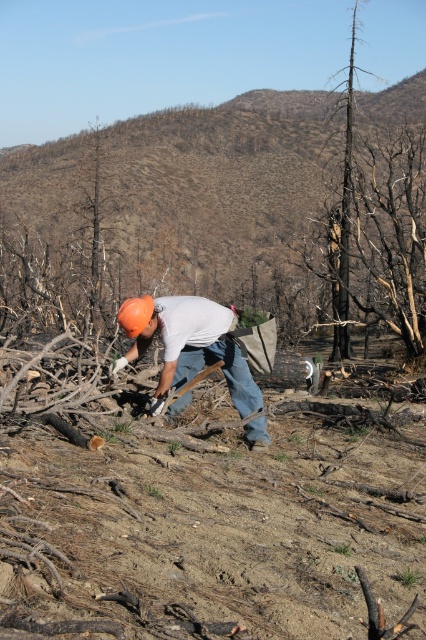
Question: Is burnt wood at center positioned before burnt wood tree at upper right?

Choices:
 (A) yes
 (B) no

Answer: (B)

Question: Is burnt wood tree at upper right to the left of orange matte helmet at center from the viewer's perspective?

Choices:
 (A) no
 (B) yes

Answer: (A)

Question: Which object appears closest to the camera in this image?

Choices:
 (A) burnt wood at center
 (B) burnt wood tree at upper right
 (C) orange matte helmet at center

Answer: (C)

Question: Which object is positioned farthest from the burnt wood tree at upper right?

Choices:
 (A) burnt wood at center
 (B) orange matte helmet at center

Answer: (B)

Question: Does burnt wood tree at upper right come in front of orange matte helmet at center?

Choices:
 (A) yes
 (B) no

Answer: (B)

Question: Which object appears closest to the camera in this image?

Choices:
 (A) burnt wood tree at upper right
 (B) orange matte helmet at center
 (C) burnt wood at center

Answer: (B)